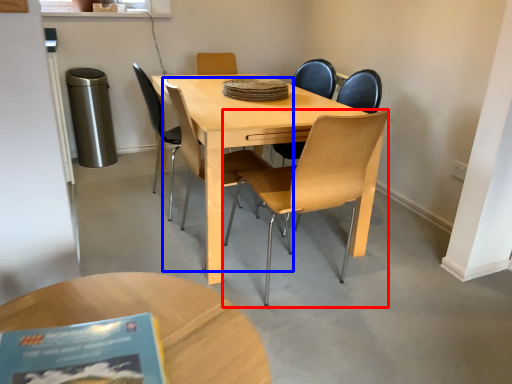
Question: Which point is closer to the camera, chair (highlighted by a red box) or chair (highlighted by a blue box)?

Choices:
 (A) chair
 (B) chair

Answer: (A)